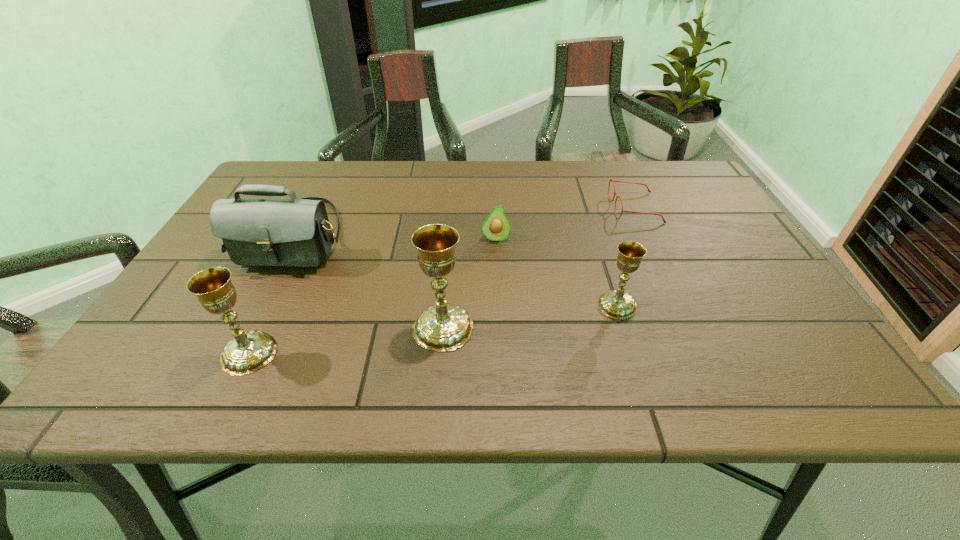
Image resolution: width=960 pixels, height=540 pixels. Find the location of `vacant space that satisfies the following two spatial constraints: 1. on the face of the shortest object; 2. on the front side of the shoulder bag`. vacant space that satisfies the following two spatial constraints: 1. on the face of the shortest object; 2. on the front side of the shoulder bag is located at coordinates (648, 236).

At what (x,y) coordinates should I click in order to perform the action: click on vacant point that satisfies the following two spatial constraints: 1. on the face of the shortest object; 2. on the front side of the shoulder bag. Please return your answer as a coordinate pair (x, y). Looking at the image, I should click on (648, 236).